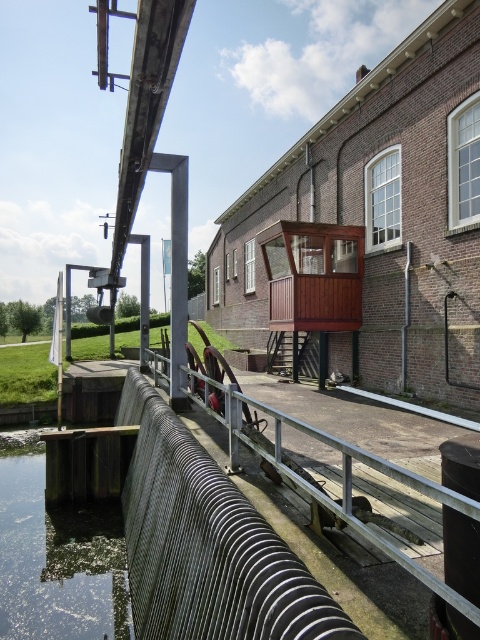
Question: Can you confirm if green algae-covered water at lower left is smaller than metallic ribbed rail at center?

Choices:
 (A) no
 (B) yes

Answer: (B)

Question: Which object is farther from the camera taking this photo?

Choices:
 (A) metallic ribbed rail at center
 (B) green algae-covered water at lower left

Answer: (B)

Question: Can you confirm if green algae-covered water at lower left is bigger than metallic ribbed rail at center?

Choices:
 (A) yes
 (B) no

Answer: (B)

Question: Which object is farther from the camera taking this photo?

Choices:
 (A) green algae-covered water at lower left
 (B) metallic ribbed rail at center

Answer: (A)

Question: Can you confirm if green algae-covered water at lower left is smaller than metallic ribbed rail at center?

Choices:
 (A) yes
 (B) no

Answer: (A)

Question: Which point is farther to the camera?

Choices:
 (A) (113, 556)
 (B) (463, 611)

Answer: (A)